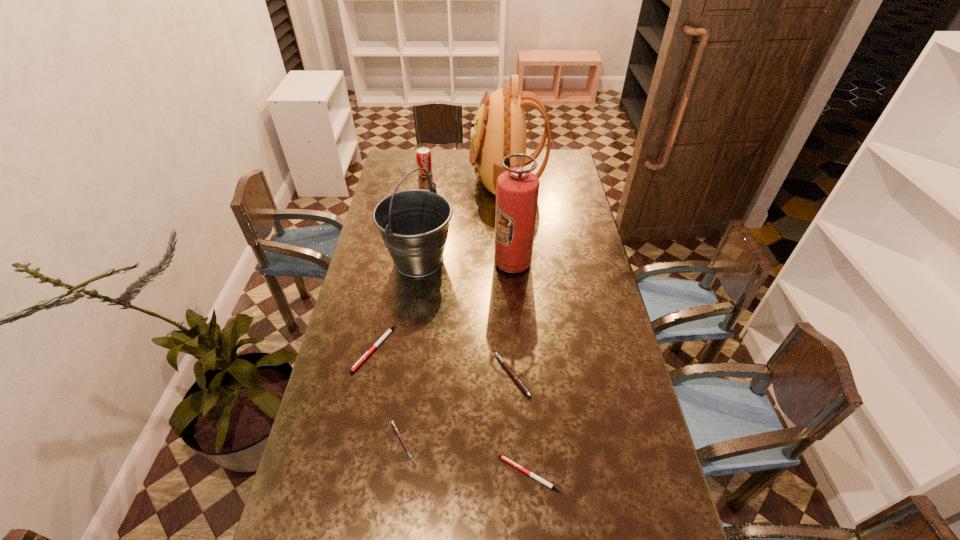
Where is `free spot located 0.210m on the front of the fourth tallest object`? free spot located 0.210m on the front of the fourth tallest object is located at coordinates (420, 203).

Find the location of a particular element. The height and width of the screenshot is (540, 960). vacant space located at the nib of the farther pink pen is located at coordinates tap(418, 375).

Find the location of a particular element. This screenshot has width=960, height=540. vacant space located 0.390m at the nib of the farther pink pen is located at coordinates (369, 375).

Identify the location of free space located 0.290m at the nib of the farther pink pen. (401, 375).

This screenshot has height=540, width=960. In order to click on vacant space located on the clicker of the left white pen in this screenshot , I will do `click(352, 455)`.

I want to click on free space located 0.170m at the nib of the nearer pink pen, so click(x=479, y=442).

You are a GUI agent. You are given a task and a screenshot of the screen. Output one action in this format:
    pyautogui.click(x=<x>, y=<y>)
    Task: Click on the free space located 0.230m on the clicker of the smaller white pen
    The image size is (960, 540).
    Given the screenshot: What is the action you would take?
    pyautogui.click(x=410, y=474)

Find the location of a particular element. Image resolution: width=960 pixels, height=540 pixels. vacant area situated on the clicker of the smaller white pen is located at coordinates (372, 474).

At what (x,y) coordinates should I click in order to perform the action: click on free space located on the clicker of the smaller white pen. Please return your answer as a coordinate pair (x, y). This screenshot has height=540, width=960. Looking at the image, I should click on (448, 474).

At what (x,y) coordinates should I click in order to perform the action: click on backpack that is at the far edge. Please return your answer as a coordinate pair (x, y). Looking at the image, I should click on (499, 129).